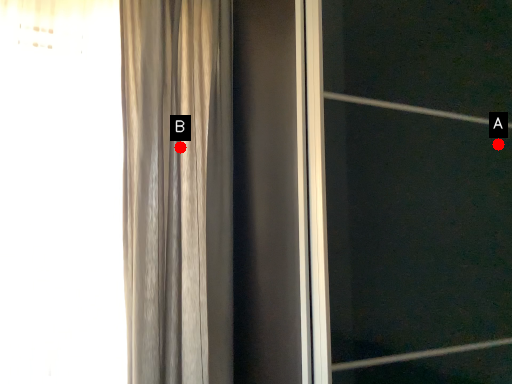
Question: Two points are circled on the image, labeled by A and B beside each circle. Which point is closer to the camera?

Choices:
 (A) A is closer
 (B) B is closer

Answer: (A)